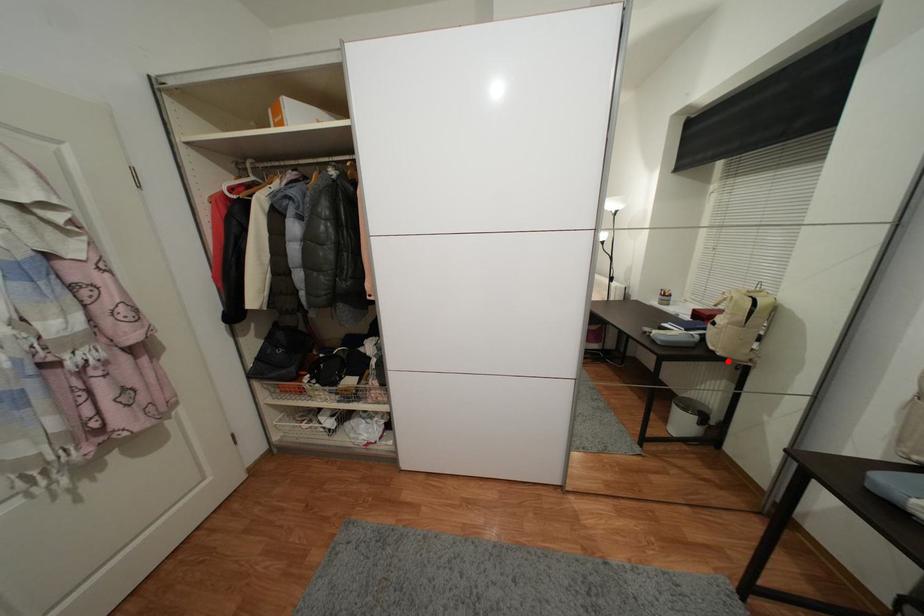
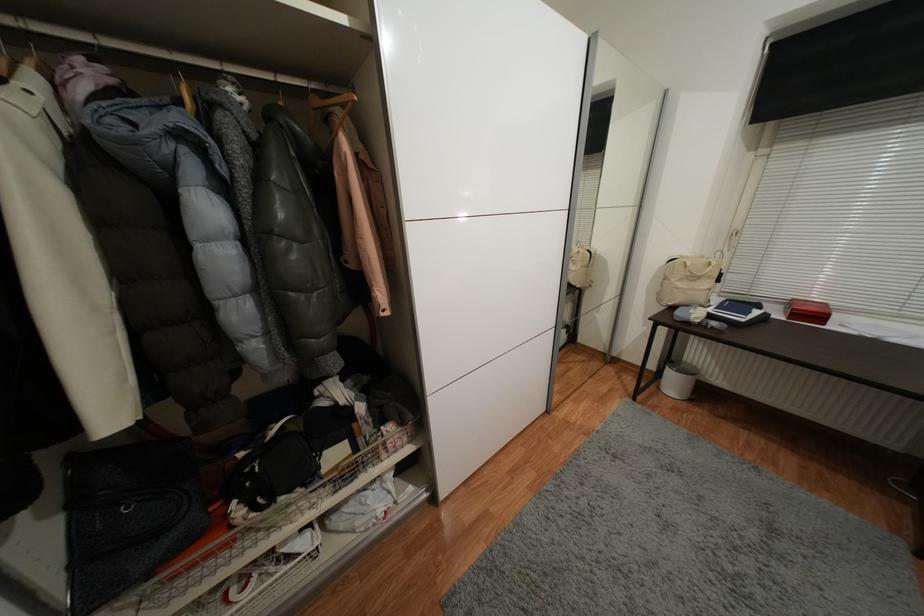
Locate, in the second image, the point that corresponds to the highlighted location in the first image.

(582, 291)